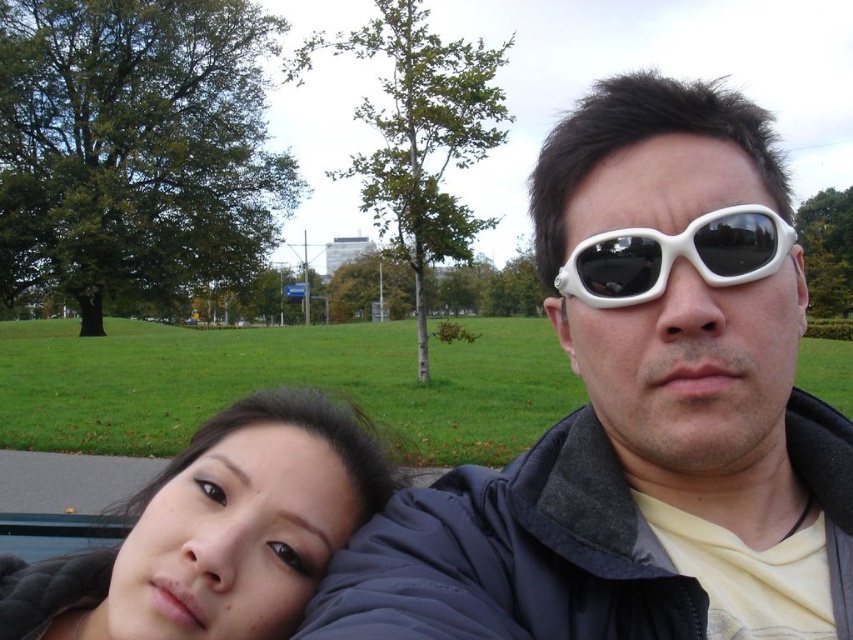
Can you confirm if white plastic sunglasses at upper right is wider than smooth black hair at lower left?

Yes, white plastic sunglasses at upper right is wider than smooth black hair at lower left.

Is point (821, 588) farther from viewer compared to point (254, 520)?

No, (821, 588) is in front of (254, 520).

Does point (798, 582) come in front of point (222, 625)?

Yes, it is.

Locate an element on the screen. The height and width of the screenshot is (640, 853). white plastic sunglasses at upper right is located at coordinates (639, 413).

Who is shorter, smooth black hair at lower left or white matte goggles at upper right?

white matte goggles at upper right is shorter.

Does smooth black hair at lower left lie behind white matte goggles at upper right?

Yes.

At what (x,y) coordinates should I click in order to perform the action: click on smooth black hair at lower left. Please return your answer as a coordinate pair (x, y). Image resolution: width=853 pixels, height=640 pixels. Looking at the image, I should click on (216, 532).

Who is more distant from viewer, (614, 131) or (724, 218)?

The point (614, 131) is more distant.

Who is lower down, white plastic sunglasses at upper right or white matte goggles at upper right?

Positioned lower is white plastic sunglasses at upper right.

Is point (840, 577) farther from camera compared to point (651, 243)?

Yes, point (840, 577) is behind point (651, 243).

Find the location of `white plastic sunglasses at upper right`. white plastic sunglasses at upper right is located at coordinates click(x=639, y=413).